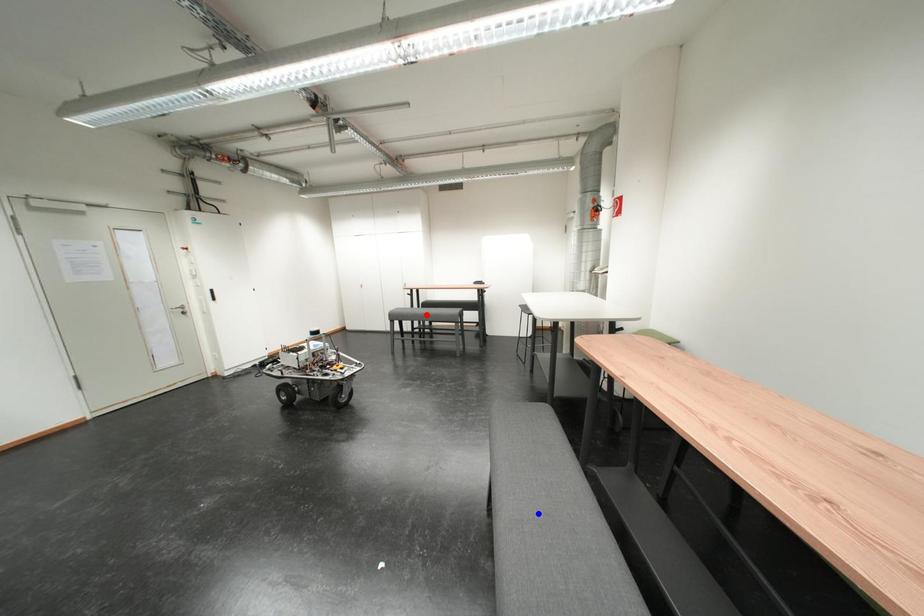
Question: Two points are marked on the image. Which point is closer to the camera?

Choices:
 (A) Blue point is closer.
 (B) Red point is closer.

Answer: (A)